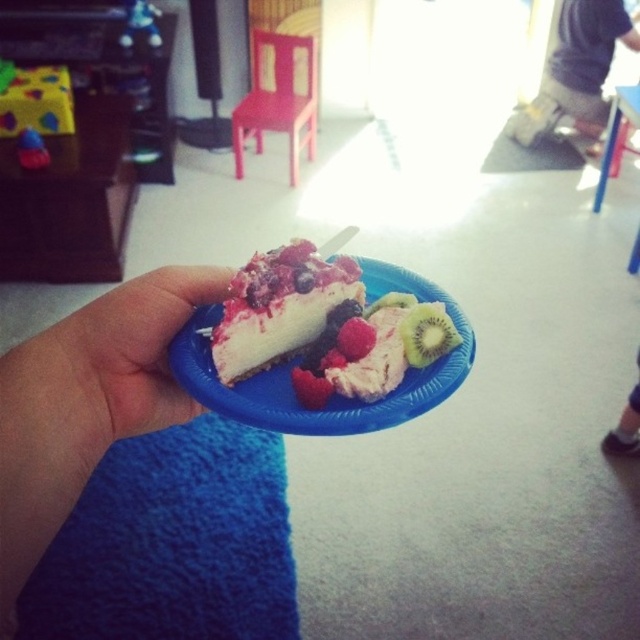
You are a chef trying to place a pink frosted cake at center and a raspberry soft at center on a small blue disposable plate. Given that the plate has a diameter of 7 inches, can both items fit without overlapping?

The pink frosted cake at center and raspberry soft at center are 1.85 inches apart, so they can fit on the 7 inch plate without overlapping since the distance between them is less than the plate diameter.

You are a photographer setting up a food shoot. You have a blue cotton shirt at upper right and a raspberry matte at center. Which object is more to the right?

The blue cotton shirt at upper right is positioned on the right side of raspberry matte at center, so it is more to the right.

You are a child trying to reach the two points marked in the image. The first point is at coordinate point (x=356, y=387) and the second is at point (x=305, y=396). Which point is closer to you?

Point (x=305, y=396) is closer to you because point (x=356, y=387) is behind it.